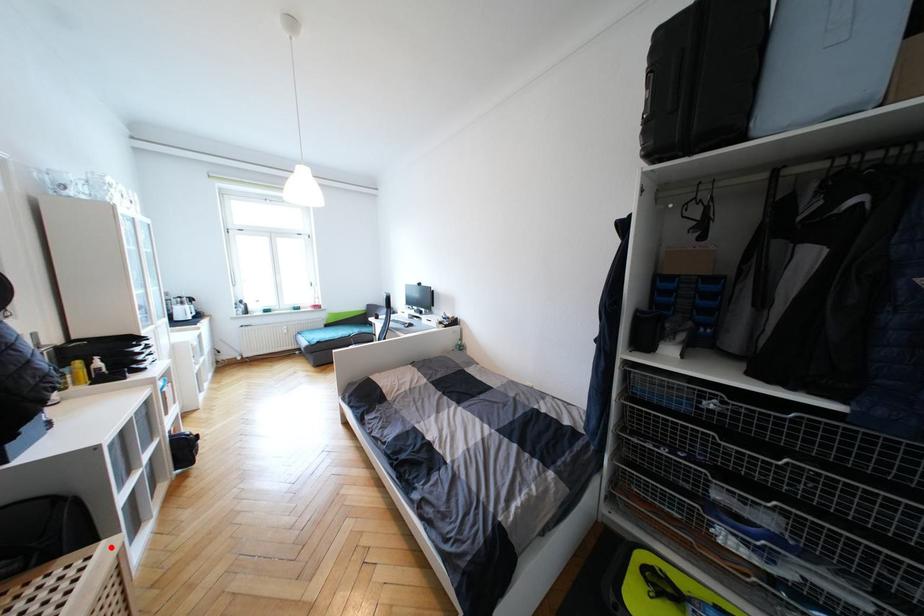
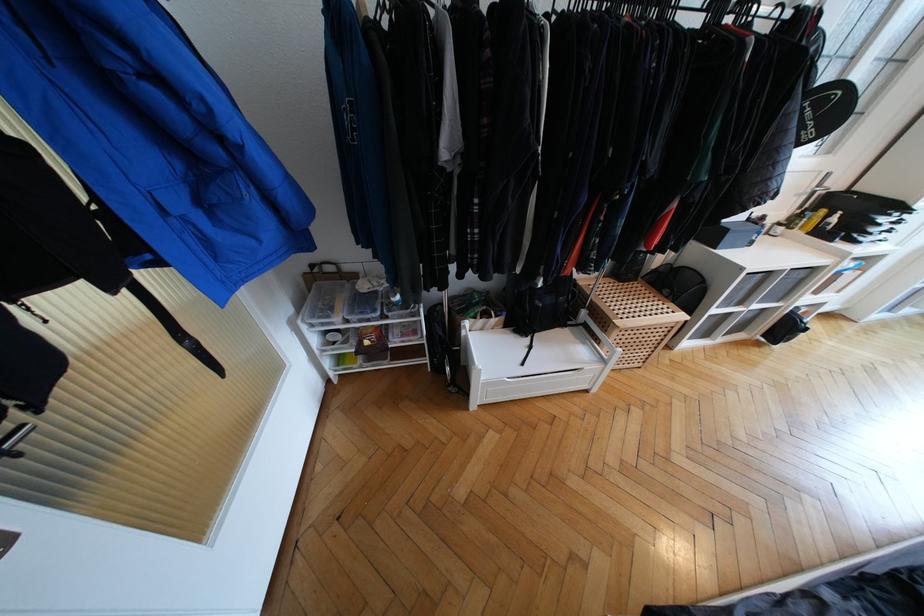
In the second image, find the point that corresponds to the highlighted location in the first image.

(685, 317)